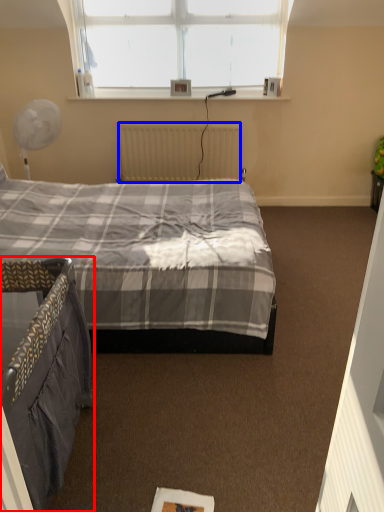
Question: Which point is closer to the camera, bed (highlighted by a red box) or radiator (highlighted by a blue box)?

Choices:
 (A) bed
 (B) radiator

Answer: (A)